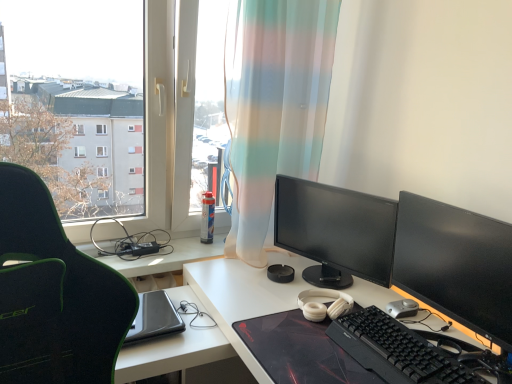
You are a GUI agent. You are given a task and a screenshot of the screen. Output one action in this format:
    pyautogui.click(x=<x>, y=<y>)
    Task: Click on the blank space above black textured mousepad at center (from a real-world perspective)
    The width and height of the screenshot is (512, 384).
    Given the screenshot: What is the action you would take?
    pyautogui.click(x=321, y=345)